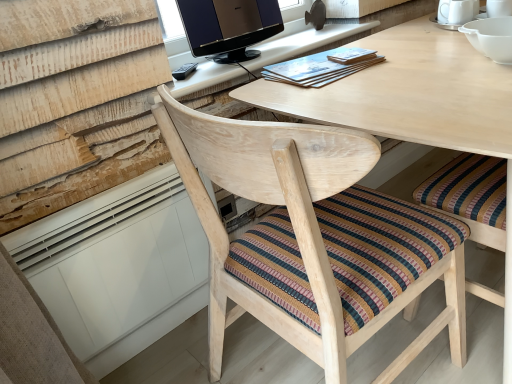
Where is `vacant space behind matte brown book at upper center, the first book positioned from the right`? vacant space behind matte brown book at upper center, the first book positioned from the right is located at coordinates tap(333, 53).